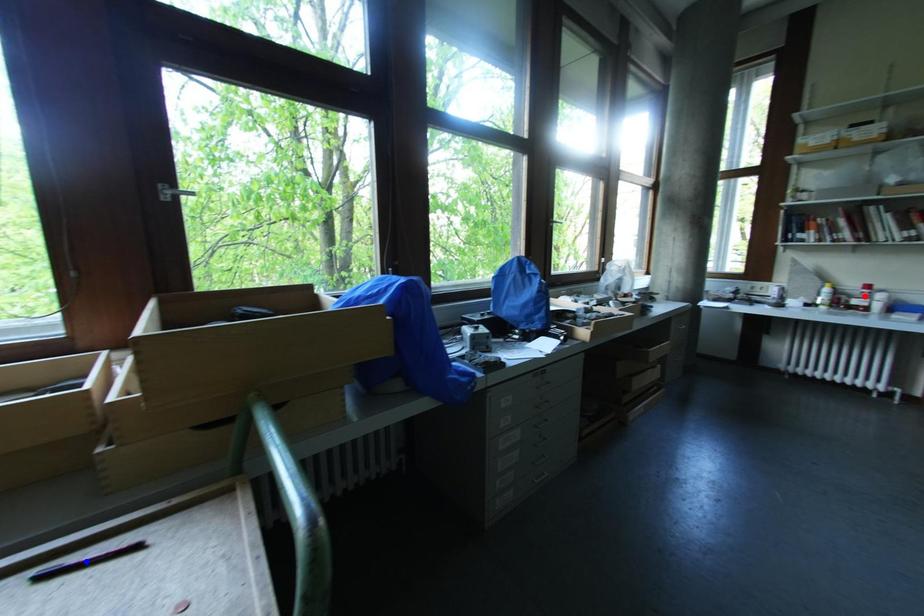
Question: In the image, two points are highlighted. Which point is nearer to the camera? Reply with the corresponding letter.

Choices:
 (A) blue point
 (B) red point

Answer: (A)